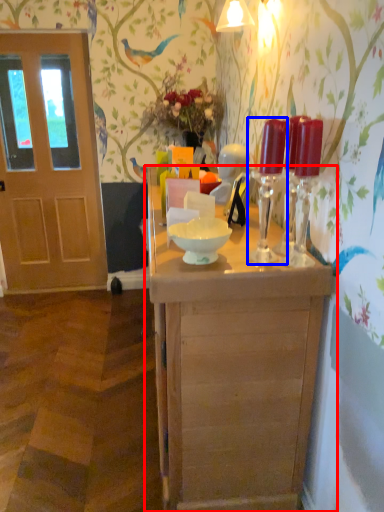
Question: Among these objects, which one is farthest to the camera, table (highlighted by a red box) or candle holder (highlighted by a blue box)?

Choices:
 (A) table
 (B) candle holder

Answer: (B)